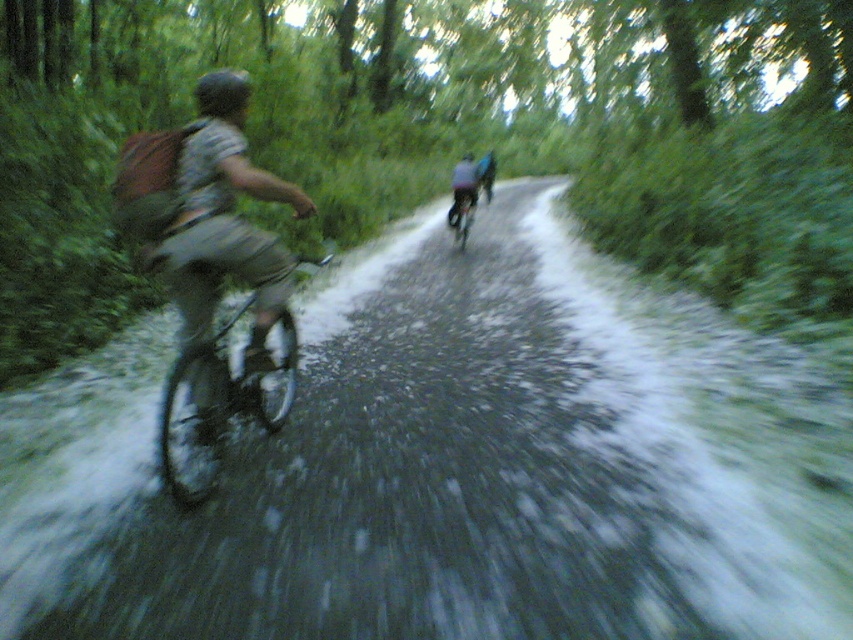
Question: Observing the image, what is the correct spatial positioning of matte gray shorts at left in reference to metallic silver bicycle at center?

Choices:
 (A) left
 (B) right

Answer: (A)

Question: Can you confirm if metallic silver bicycle at left is wider than matte black helmet at upper center?

Choices:
 (A) no
 (B) yes

Answer: (A)

Question: Estimate the real-world distances between objects in this image. Which object is farther from the matte black helmet at upper center?

Choices:
 (A) metallic silver bicycle at left
 (B) metallic silver bicycle at center

Answer: (B)

Question: Which of the following is the farthest from the observer?

Choices:
 (A) (209, 444)
 (B) (235, 84)
 (C) (457, 218)

Answer: (C)

Question: Which object is closer to the camera taking this photo?

Choices:
 (A) matte black helmet at upper center
 (B) metallic silver bicycle at center
 (C) matte gray shorts at left

Answer: (C)

Question: Is metallic silver bicycle at left bigger than metallic silver bicycle at center?

Choices:
 (A) no
 (B) yes

Answer: (A)